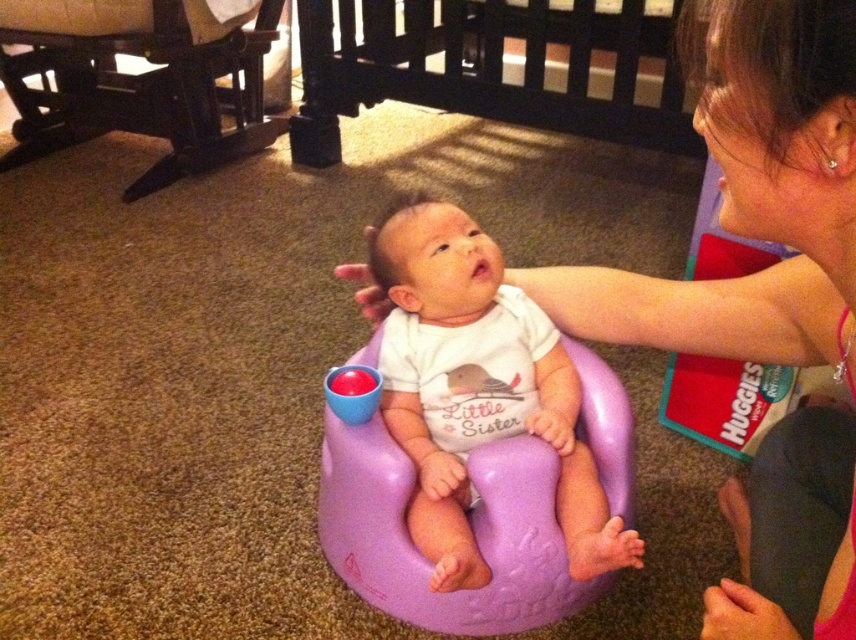
In the scene shown: You are a drone flying above the scene. You need to drop a small toy to the point closer to you between point (694, 54) and point (302, 52). Which point should you choose?

You should choose point (694, 54) because it is closer to the viewer than point (302, 52).

You are a parent trying to choose seating for your baby. You have a purple plastic baby seat at center and a dark wood rocking chair at lower left. Which one is more suitable for a newborn who needs to be held upright?

The purple plastic baby seat at center is more suitable for a newborn who needs to be held upright because it is designed to support infants in an upright position, unlike the larger dark wood rocking chair at lower left which may not provide the necessary support.